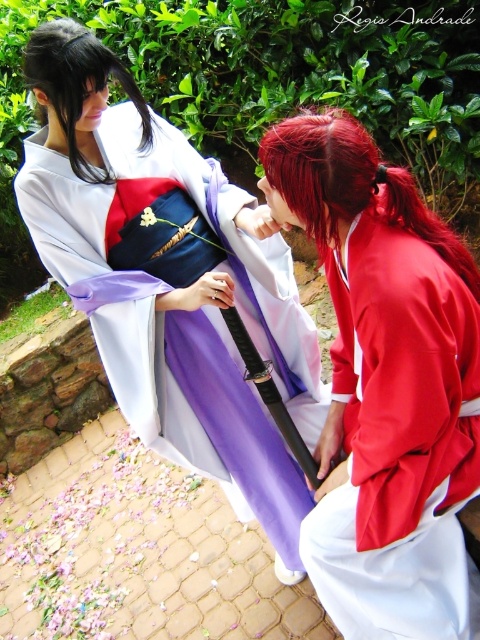
Question: Which of the following is the farthest from the observer?

Choices:
 (A) (313, 440)
 (B) (406, 321)
 (C) (86, 163)
 (D) (304, 192)

Answer: (A)

Question: Does matte white kimono at center appear on the left side of matte red kimono at center?

Choices:
 (A) yes
 (B) no

Answer: (A)

Question: Which point is farther to the camera?

Choices:
 (A) (324, 179)
 (B) (384, 307)
 (C) (194, 163)

Answer: (C)

Question: Which of the following is the farthest from the observer?

Choices:
 (A) shiny red hair at center
 (B) black silky hair at upper left
 (C) matte red kimono at center

Answer: (B)

Question: Observing the image, what is the correct spatial positioning of matte red kimono at center in reference to black silky hair at upper left?

Choices:
 (A) below
 (B) above

Answer: (A)

Question: Is shiny red hair at center to the right of black silky hair at upper left from the viewer's perspective?

Choices:
 (A) no
 (B) yes

Answer: (B)